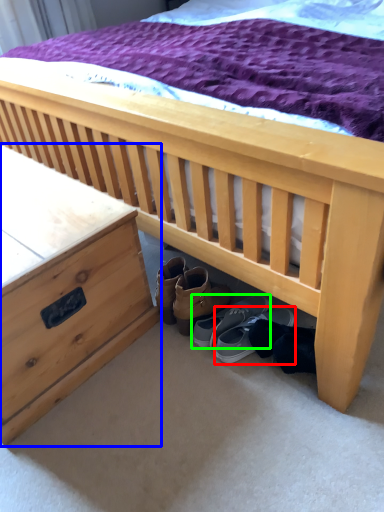
Question: Which object is positioned closest to footwear (highlighted by a red box)? Select from nightstand (highlighted by a blue box) and footwear (highlighted by a green box).

Choices:
 (A) nightstand
 (B) footwear

Answer: (B)